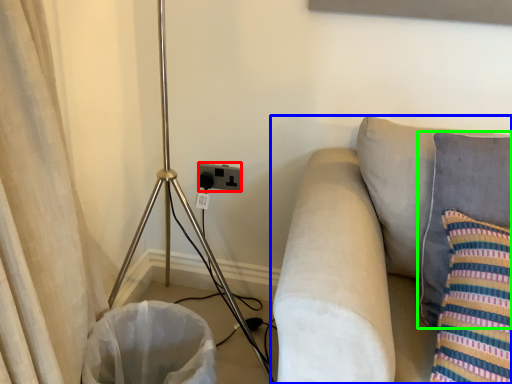
Question: Estimate the real-world distances between objects in this image. Which object is farther from electric outlet (highlighted by a red box), studio couch (highlighted by a blue box) or pillow (highlighted by a green box)?

Choices:
 (A) studio couch
 (B) pillow

Answer: (B)